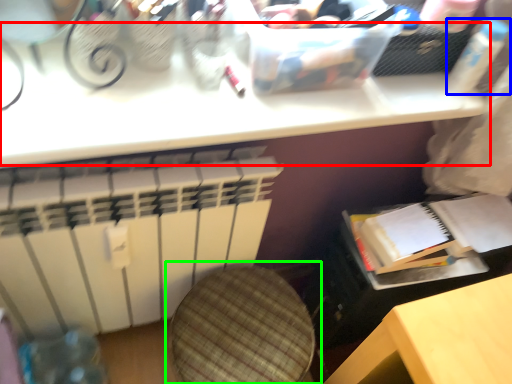
Question: Which object is the closest to the table (highlighted by a red box)? Choose among these: bottle (highlighted by a blue box) or swivel chair (highlighted by a green box).

Choices:
 (A) bottle
 (B) swivel chair

Answer: (A)